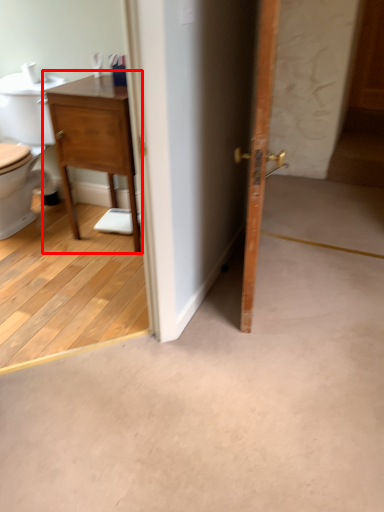
Question: From the image's perspective, where is nightstand (annotated by the red box) located in relation to door in the image?

Choices:
 (A) above
 (B) below

Answer: (A)